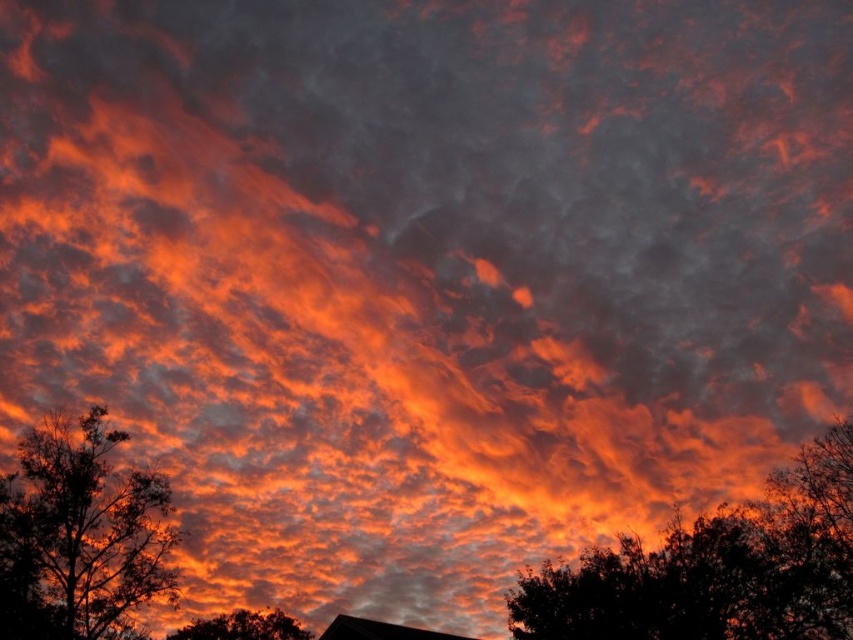
Can you confirm if silhouette leafy tree at lower right is shorter than dark green leafy tree at lower center?

In fact, silhouette leafy tree at lower right may be taller than dark green leafy tree at lower center.

Is silhouette leafy tree at lower right closer to camera compared to dark green leafy tree at lower center?

Yes, it is in front of dark green leafy tree at lower center.

Does point (815, 497) come behind point (285, 632)?

No, (815, 497) is closer to viewer.

You are a GUI agent. You are given a task and a screenshot of the screen. Output one action in this format:
    pyautogui.click(x=<x>, y=<y>)
    Task: Click on the silhouette leafy tree at lower right
    
    Given the screenshot: What is the action you would take?
    pyautogui.click(x=717, y=568)

The image size is (853, 640). What do you see at coordinates (83, 529) in the screenshot?
I see `dark green leafy tree at left` at bounding box center [83, 529].

Is dark green leafy tree at left below dark green leafy tree at lower center?

Actually, dark green leafy tree at left is above dark green leafy tree at lower center.

Is point (32, 504) closer to viewer compared to point (198, 637)?

Yes.

You are a GUI agent. You are given a task and a screenshot of the screen. Output one action in this format:
    pyautogui.click(x=<x>, y=<y>)
    Task: Click on the dark green leafy tree at left
    
    Given the screenshot: What is the action you would take?
    pyautogui.click(x=83, y=529)

Which is above, silhouette leafy tree at lower right or dark green leafy tree at left?

dark green leafy tree at left

Between point (680, 589) and point (126, 548), which one is positioned behind?

The point (126, 548) is more distant.

Is point (662, 582) positioned behind point (109, 502)?

That is False.

The image size is (853, 640). Identify the location of silhouette leafy tree at lower right. (717, 568).